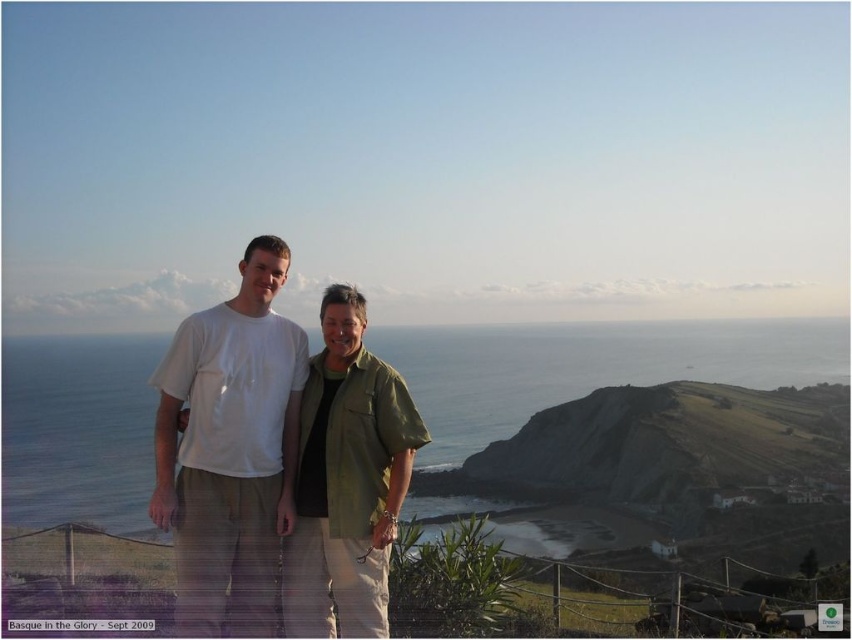
Question: Which of the following is the farthest from the observer?

Choices:
 (A) (515, 410)
 (B) (193, 502)
 (C) (363, 374)

Answer: (A)

Question: Which point appears closest to the camera in this image?

Choices:
 (A) (332, 470)
 (B) (250, 332)

Answer: (A)

Question: From the image, what is the correct spatial relationship of white cotton shirt at center in relation to green fabric shirt at center?

Choices:
 (A) above
 (B) below

Answer: (A)

Question: Is blue water at center bigger than white cotton shirt at center?

Choices:
 (A) no
 (B) yes

Answer: (B)

Question: Which point is closer to the camera taking this photo?

Choices:
 (A) (173, 506)
 (B) (311, 474)

Answer: (A)

Question: Can you confirm if white cotton shirt at center is positioned to the left of green fabric shirt at center?

Choices:
 (A) no
 (B) yes

Answer: (B)